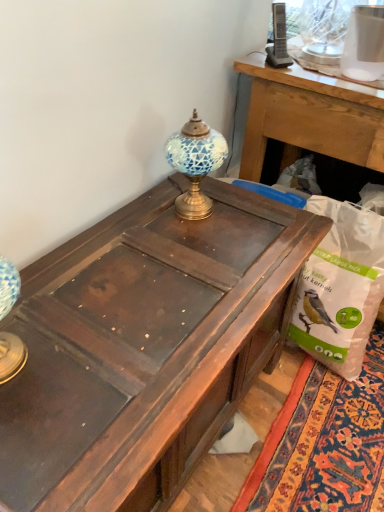
The height and width of the screenshot is (512, 384). What are the coordinates of `vacant area that lies in front of blue mosaic glass at center` in the screenshot? It's located at (190, 241).